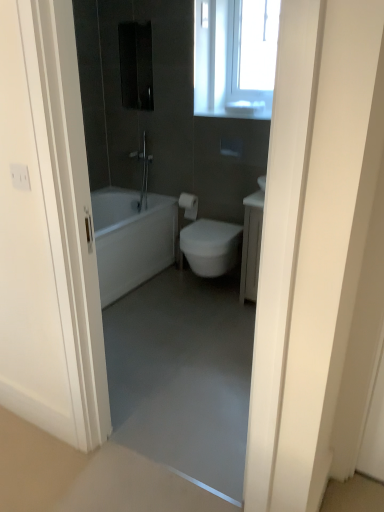
Identify the location of vacant space behind white glossy door at upper center. (226, 437).